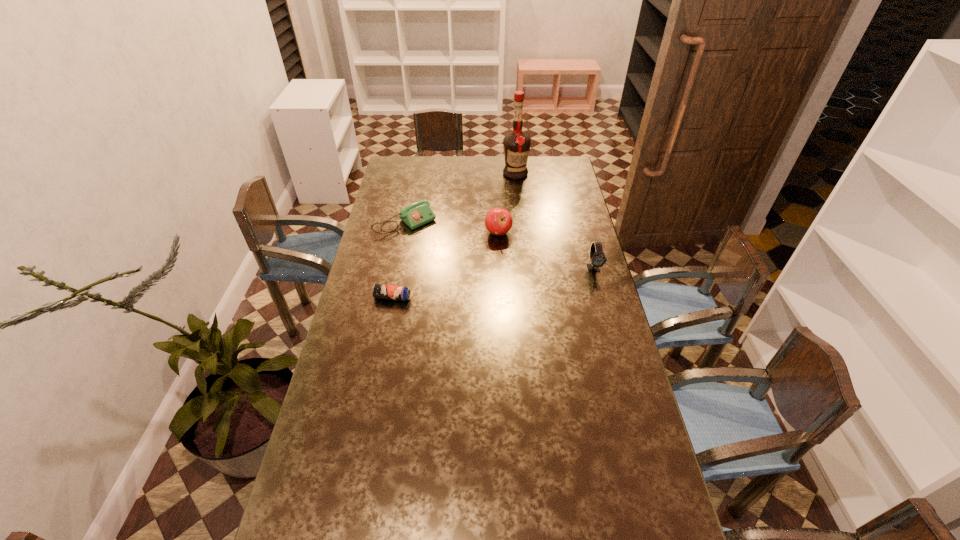
Identify the location of vacant region between the nearest object and the watch. Image resolution: width=960 pixels, height=540 pixels. (492, 283).

Find the location of `empty space that is in between the tallest object and the beer can`. empty space that is in between the tallest object and the beer can is located at coordinates (454, 235).

The height and width of the screenshot is (540, 960). What are the coordinates of `empty space between the apple and the second nearest object` in the screenshot? It's located at (546, 251).

At what (x,y) coordinates should I click in order to perform the action: click on free space between the rightmost object and the nearest object. Please return your answer as a coordinate pair (x, y). Looking at the image, I should click on (492, 283).

Where is `free area in between the beer can and the second nearest object`? Image resolution: width=960 pixels, height=540 pixels. free area in between the beer can and the second nearest object is located at coordinates (492, 283).

This screenshot has width=960, height=540. I want to click on free area in between the watch and the apple, so click(x=546, y=251).

Locate an element on the screen. unoccupied area between the shortest object and the fourth tallest object is located at coordinates (398, 260).

Choose which object is the nearest neighbor to the second nearest object. Please provide its 2D coordinates. Your answer should be formatted as a tuple, i.e. [(x, y)], where the tuple contains the x and y coordinates of a point satisfying the conditions above.

[(498, 221)]

What are the coordinates of `the fourth closest object to the apple` in the screenshot? It's located at [379, 291].